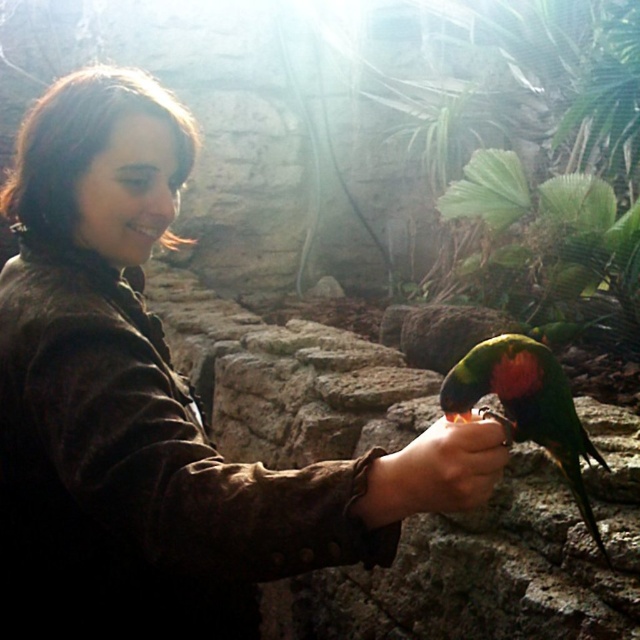
You are a photographer trying to capture a closeup of the multicolored feathered parrot at center while ensuring the brown suede jacket at center is still visible in the frame. Can you fit both in the shot without zooming in too much?

The brown suede jacket at center has a larger size compared to the multicolored feathered parrot at center, so yes, you can fit both in the shot without zooming in too much because the jacket is bigger and will occupy more space, allowing the parrot to be visible alongside it.

You are a photographer trying to capture the parrot on the person hand. The camera is at point (522,404). The parrot is 3.44 feet away from the camera. Is the parrot within the camera focus range of 3 feet?

A: The parrot is 3.44 feet away from the camera at point (522,404), which is beyond the camera focus range of 3 feet. Therefore, the parrot is out of focus range.

You are standing in the enclosure and want to take a photo of the brown suede jacket at center. Where should you position yourself to capture it in the frame?

To capture the brown suede jacket at center in the frame, position yourself facing the center of the enclosure where the jacket is located at coordinates approximately 0.639 on the x and 0.241 on the y axis.